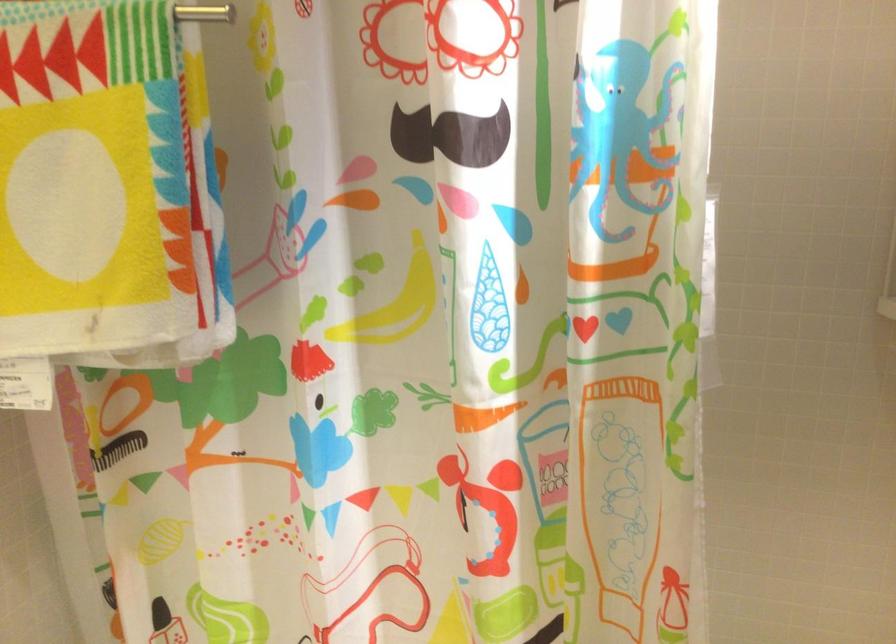
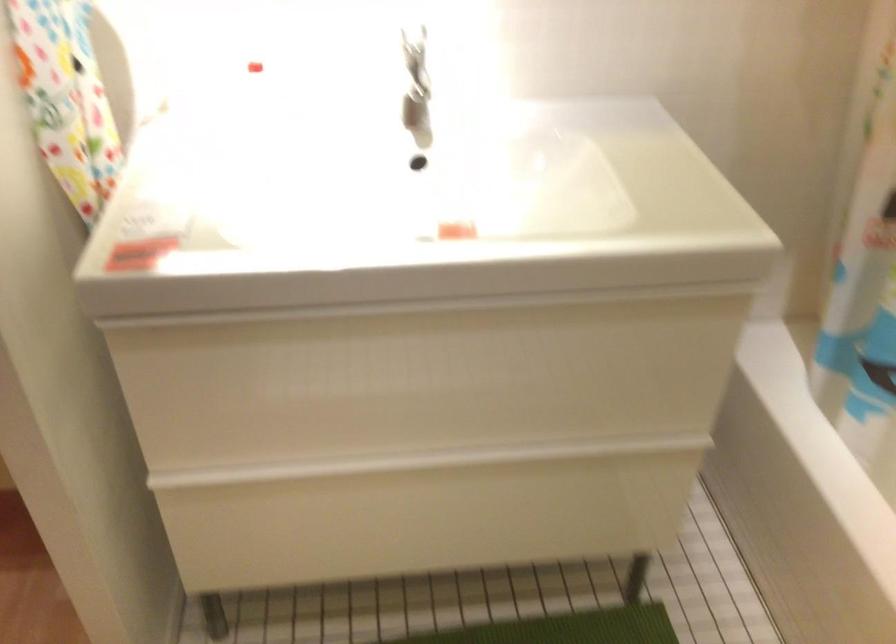
How did the camera likely rotate?

The rotation direction of the camera is left-down.